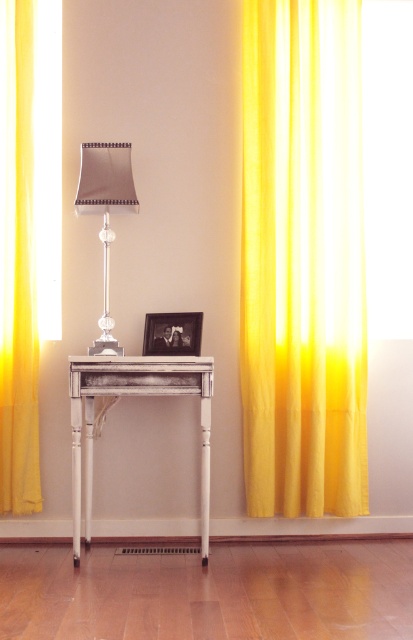
Does point (296, 196) come farther from viewer compared to point (398, 22)?

No, (296, 196) is closer to viewer.

Who is more distant from viewer, (x=322, y=444) or (x=374, y=284)?

Positioned behind is point (x=374, y=284).

At what (x,y) coordinates should I click in order to perform the action: click on yellow sheer curtain at right. Please return your answer as a coordinate pair (x, y). This screenshot has width=413, height=640. Looking at the image, I should click on (303, 259).

Who is more forward, (318, 314) or (90, 353)?

Point (90, 353) is in front.

Is yellow sheer curtain at right thinner than metallic silver table lamp at center?

No.

What do you see at coordinates (303, 259) in the screenshot? The image size is (413, 640). I see `yellow sheer curtain at right` at bounding box center [303, 259].

Find the location of a particular element. Image resolution: width=413 pixels, height=640 pixels. yellow sheer curtain at right is located at coordinates (303, 259).

Does yellow sheer curtain at left have a greater width compared to white distressed wood table at center?

In fact, yellow sheer curtain at left might be narrower than white distressed wood table at center.

Where is `yellow sheer curtain at left`? Image resolution: width=413 pixels, height=640 pixels. yellow sheer curtain at left is located at coordinates (18, 275).